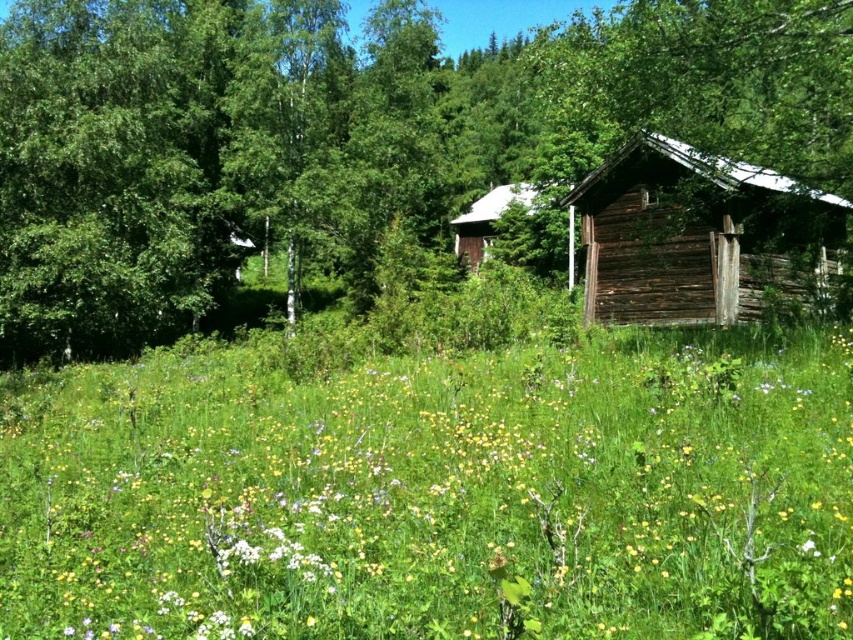
Between yellow matte flower at center and green wood tree at center, which one has less height?

yellow matte flower at center is shorter.

Can you confirm if yellow matte flower at center is smaller than green wood tree at center?

Correct, yellow matte flower at center occupies less space than green wood tree at center.

What do you see at coordinates (437, 497) in the screenshot?
I see `yellow matte flower at center` at bounding box center [437, 497].

You are a GUI agent. You are given a task and a screenshot of the screen. Output one action in this format:
    pyautogui.click(x=<x>, y=<y>)
    Task: Click on the yellow matte flower at center
    Image resolution: width=853 pixels, height=640 pixels.
    Given the screenshot: What is the action you would take?
    pyautogui.click(x=437, y=497)

Does yellow matte flower at center have a greater height compared to weathered wood cabin at right?

Correct, yellow matte flower at center is much taller as weathered wood cabin at right.

Does point (552, 360) come behind point (714, 301)?

No, (552, 360) is closer to viewer.

You are a GUI agent. You are given a task and a screenshot of the screen. Output one action in this format:
    pyautogui.click(x=<x>, y=<y>)
    Task: Click on the yellow matte flower at center
    The image size is (853, 640).
    Given the screenshot: What is the action you would take?
    [x=437, y=497]

Does green wood tree at center lie behind wooden cabin at center?

No, it is in front of wooden cabin at center.

Looking at this image, is green wood tree at center positioned before wooden cabin at center?

That is True.

Is point (7, 48) farther from camera compared to point (474, 252)?

No, (7, 48) is in front of (474, 252).

You are a GUI agent. You are given a task and a screenshot of the screen. Output one action in this format:
    pyautogui.click(x=<x>, y=<y>)
    Task: Click on the green wood tree at center
    
    Given the screenshot: What is the action you would take?
    pyautogui.click(x=347, y=134)